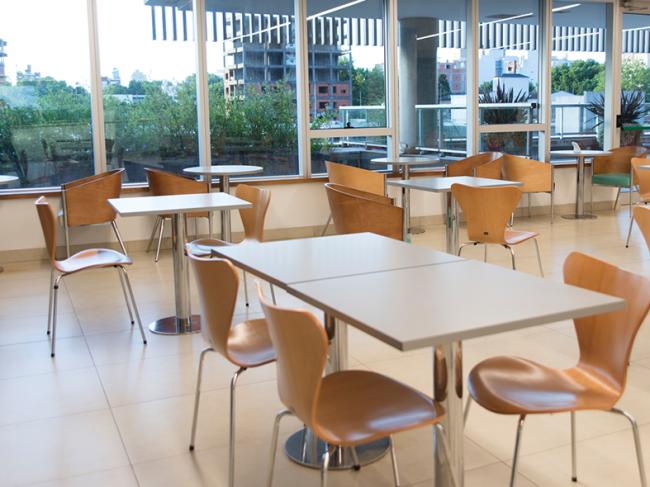
Identify the location of windowpanes. This screenshot has height=487, width=650. pyautogui.click(x=49, y=80), pyautogui.click(x=155, y=93), pyautogui.click(x=228, y=100), pyautogui.click(x=333, y=86), pyautogui.click(x=348, y=149), pyautogui.click(x=436, y=80), pyautogui.click(x=520, y=72), pyautogui.click(x=517, y=140), pyautogui.click(x=569, y=95), pyautogui.click(x=632, y=73).